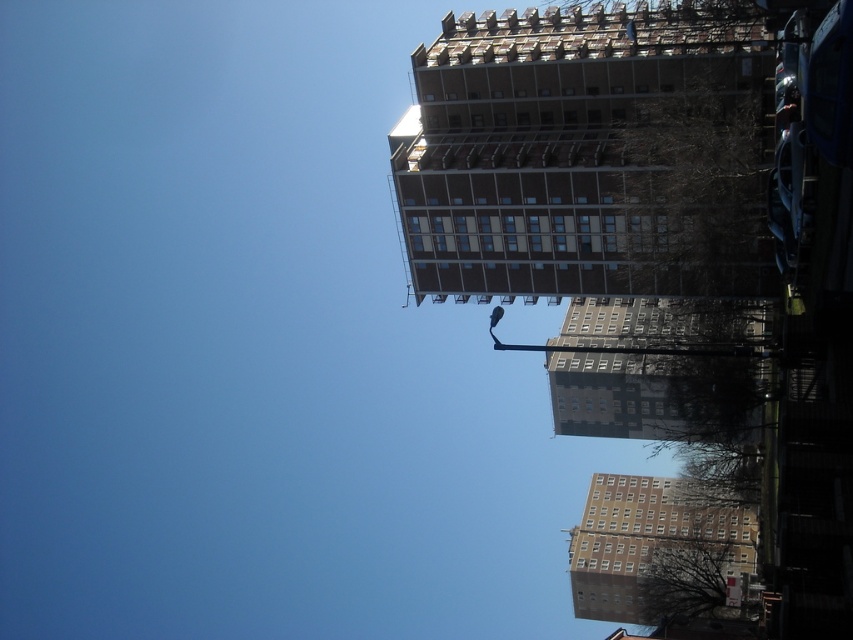
You are a delivery drone flying at an altitude of 10 meters. You need to deliver a package to the gray concrete building at center. There is a brown concrete building at lower right nearby. Can you safely fly between them at your current altitude?

The brown concrete building at lower right is 18.80 meters away from the gray concrete building at center. Since the distance between them is greater than the drone safety margin, the drone can safely fly between them at 10 meters altitude.

You are standing on the sidewalk looking at the brown brick building at upper center and the brown concrete building at lower right. Which building is closer to you?

The brown brick building at upper center is closer to you because it is in front of the brown concrete building at lower right.